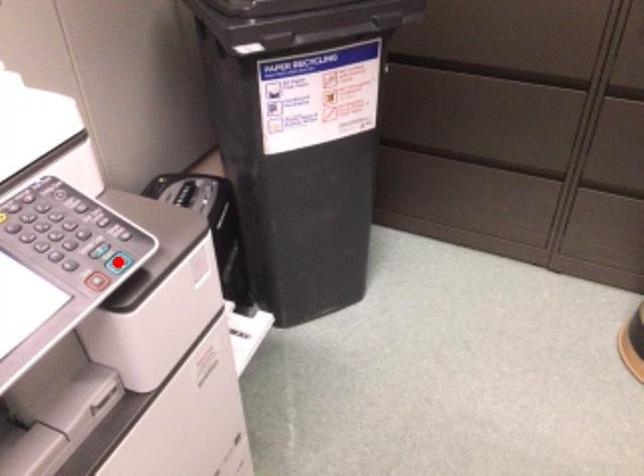
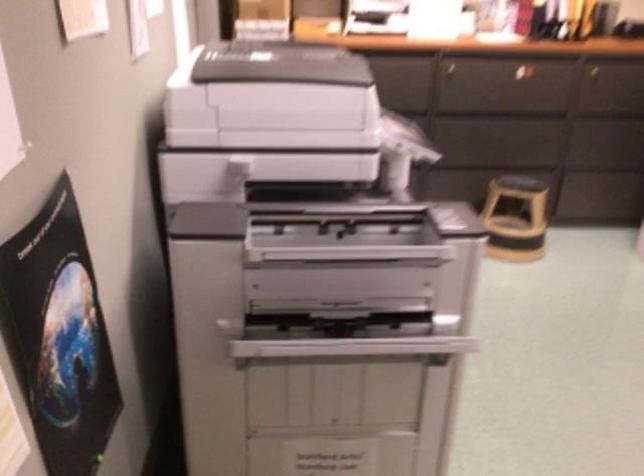
Question: I am providing you with two images of the same scene from different viewpoints. A red point is marked on the first image. Is the red point's position out of view in image 2?

Choices:
 (A) Yes
 (B) No

Answer: (A)